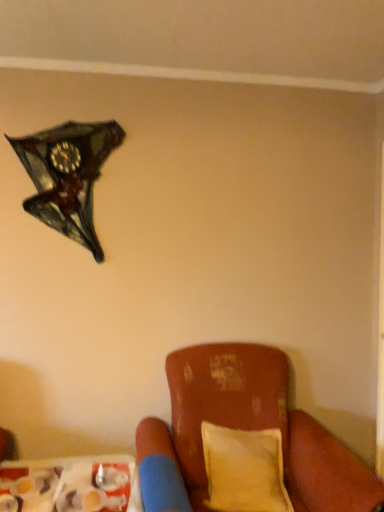
The image size is (384, 512). Identify the location of yellow fabric pillow at lower right. (244, 470).

This screenshot has width=384, height=512. What are the coordinates of `shiny glass clock at upper left` in the screenshot? It's located at (68, 175).

Measure the distance between plastic tray at lower left and camera.

They are 5.27 feet apart.

Where is `leather cushion at lower right`? leather cushion at lower right is located at coordinates point(244,430).

Identify the location of yellow fabric pillow at lower right. (244, 470).

From the picture: Which point is more distant from viewer, (219, 430) or (43, 496)?

The point (219, 430) is farther.

Measure the distance from yellow fabric pillow at lower right to plastic tray at lower left.

yellow fabric pillow at lower right and plastic tray at lower left are 20.85 inches apart from each other.

Between yellow fabric pillow at lower right and plastic tray at lower left, which one is positioned in front?

plastic tray at lower left is closer to the camera.

Is yellow fabric pillow at lower right positioned beyond the bounds of plastic tray at lower left?

Yes, yellow fabric pillow at lower right is not within plastic tray at lower left.

Does plastic tray at lower left contain shiny glass clock at upper left?

That's incorrect, shiny glass clock at upper left is not inside plastic tray at lower left.

Is point (110, 502) farther from viewer compared to point (67, 123)?

No, it is in front of (67, 123).

Can you tell me how much plastic tray at lower left and shiny glass clock at upper left differ in facing direction?

plastic tray at lower left and shiny glass clock at upper left are facing 2.24 degrees away from each other.

Is plastic tray at lower left in front of shiny glass clock at upper left?

Yes.

Which object is further away from the camera taking this photo, shiny glass clock at upper left or leather cushion at lower right?

shiny glass clock at upper left is behind.

Is point (95, 259) behind point (218, 350)?

Yes, point (95, 259) is farther from viewer.

Is shiny glass clock at upper left inside the boundaries of leather cushion at lower right, or outside?

shiny glass clock at upper left is not inside leather cushion at lower right, it's outside.

Is shiny glass clock at upper left oriented towards leather cushion at lower right?

No, shiny glass clock at upper left does not turn towards leather cushion at lower right.

From their relative heights in the image, would you say leather cushion at lower right is taller or shorter than shiny glass clock at upper left?

Considering their sizes, leather cushion at lower right has more height than shiny glass clock at upper left.

How distant is leather cushion at lower right from shiny glass clock at upper left?

Result: 1.09 meters.

Based on the photo, is leather cushion at lower right turned away from shiny glass clock at upper left?

leather cushion at lower right does not have its back to shiny glass clock at upper left.

Considering the relative positions of leather cushion at lower right and shiny glass clock at upper left in the image provided, is leather cushion at lower right to the left or to the right of shiny glass clock at upper left?

Based on their positions, leather cushion at lower right is located to the right of shiny glass clock at upper left.

From the image's perspective, which one is positioned higher, yellow fabric pillow at lower right or leather cushion at lower right?

leather cushion at lower right appears higher in the image.

Which of these two, yellow fabric pillow at lower right or leather cushion at lower right, stands shorter?

Standing shorter between the two is yellow fabric pillow at lower right.

Looking at this image, which point is more forward, (256,455) or (205,394)?

The point (256,455) is closer.

Is yellow fabric pillow at lower right to the left or to the right of leather cushion at lower right in the image?

yellow fabric pillow at lower right is to the left of leather cushion at lower right.

Does shiny glass clock at upper left have a lesser height compared to yellow fabric pillow at lower right?

No.

Which is correct: shiny glass clock at upper left is inside yellow fabric pillow at lower right, or outside of it?

shiny glass clock at upper left cannot be found inside yellow fabric pillow at lower right.

Considering the sizes of objects shiny glass clock at upper left and yellow fabric pillow at lower right in the image provided, who is bigger, shiny glass clock at upper left or yellow fabric pillow at lower right?

yellow fabric pillow at lower right.

How many degrees apart are the facing directions of plastic tray at lower left and yellow fabric pillow at lower right?

7.49 degrees.

Could you tell me if plastic tray at lower left is facing yellow fabric pillow at lower right?

No, plastic tray at lower left does not turn towards yellow fabric pillow at lower right.

In the scene shown: Is plastic tray at lower left completely or partially outside of yellow fabric pillow at lower right?

That's correct, plastic tray at lower left is outside of yellow fabric pillow at lower right.

Is the surface of plastic tray at lower left in direct contact with yellow fabric pillow at lower right?

No, plastic tray at lower left is not with yellow fabric pillow at lower right.

At what (x,y) coordinates should I click in order to perform the action: click on pillow behind the plastic tray at lower left. Please return your answer as a coordinate pair (x, y). This screenshot has height=512, width=384. Looking at the image, I should click on (244, 470).

Where is `table that is in front of the shiny glass clock at upper left`? The width and height of the screenshot is (384, 512). table that is in front of the shiny glass clock at upper left is located at coordinates (71, 485).

Based on their spatial positions, is yellow fabric pillow at lower right or leather cushion at lower right further from plastic tray at lower left?

yellow fabric pillow at lower right lies further to plastic tray at lower left than the other object.

Based on their spatial positions, is shiny glass clock at upper left or plastic tray at lower left further from leather cushion at lower right?

Among the two, shiny glass clock at upper left is located further to leather cushion at lower right.

Based on their spatial positions, is yellow fabric pillow at lower right or shiny glass clock at upper left closer to plastic tray at lower left?

Based on the image, yellow fabric pillow at lower right appears to be nearer to plastic tray at lower left.

Which object lies nearer to the anchor point yellow fabric pillow at lower right, plastic tray at lower left or leather cushion at lower right?

leather cushion at lower right lies closer to yellow fabric pillow at lower right than the other object.

Based on their spatial positions, is shiny glass clock at upper left or leather cushion at lower right closer to yellow fabric pillow at lower right?

Based on the image, leather cushion at lower right appears to be nearer to yellow fabric pillow at lower right.

From the image, which object appears to be farther from shiny glass clock at upper left, plastic tray at lower left or leather cushion at lower right?

Among the two, plastic tray at lower left is located further to shiny glass clock at upper left.

Consider the image. Looking at the image, which one is located further to shiny glass clock at upper left, yellow fabric pillow at lower right or plastic tray at lower left?

yellow fabric pillow at lower right is further to shiny glass clock at upper left.

Considering their positions, is shiny glass clock at upper left positioned closer to plastic tray at lower left than leather cushion at lower right?

Among the two, leather cushion at lower right is located nearer to plastic tray at lower left.

Find the location of a particular element. The height and width of the screenshot is (512, 384). pillow between shiny glass clock at upper left and plastic tray at lower left from top to bottom is located at coordinates (244, 470).

The width and height of the screenshot is (384, 512). In order to click on pillow between plastic tray at lower left and leather cushion at lower right in this screenshot , I will do `click(244, 470)`.

At what (x,y) coordinates should I click in order to perform the action: click on furniture between shiny glass clock at upper left and yellow fabric pillow at lower right vertically. Please return your answer as a coordinate pair (x, y). The image size is (384, 512). Looking at the image, I should click on (244, 430).

The image size is (384, 512). Find the location of `furniture between shiny glass clock at upper left and plastic tray at lower left in the up-down direction`. furniture between shiny glass clock at upper left and plastic tray at lower left in the up-down direction is located at coordinates (244, 430).